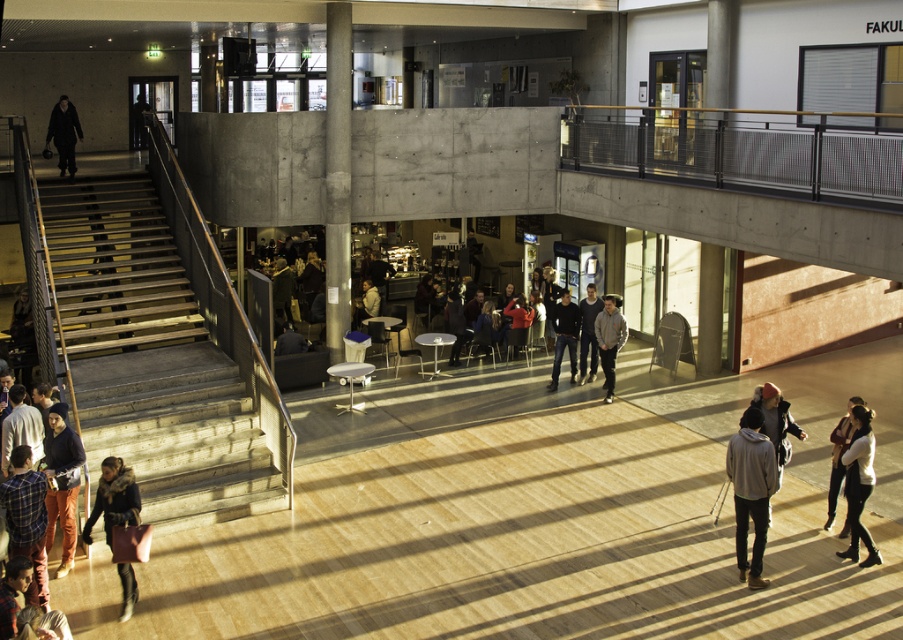
Question: Among these points, which one is farthest from the camera?

Choices:
 (A) (846, 449)
 (B) (58, 406)
 (C) (580, 381)
 (D) (551, 388)

Answer: (C)

Question: Which of the following is the closest to the observer?

Choices:
 (A) click(x=399, y=260)
 (B) click(x=61, y=118)
 (C) click(x=738, y=429)

Answer: (C)

Question: Observing the image, what is the correct spatial positioning of gray hoodie at lower right in reference to velvet brown coat at lower left?

Choices:
 (A) left
 (B) right

Answer: (B)

Question: Which of the following is the farthest from the observer?

Choices:
 (A) (574, 369)
 (B) (436, 323)
 (C) (17, 445)
 (D) (72, 534)

Answer: (B)

Question: Can you confirm if white sweater at lower right is wider than gray cotton hoodie at center?

Choices:
 (A) yes
 (B) no

Answer: (B)

Question: Does dark blue jeans at center appear on the left side of dark gray hoodie at center?

Choices:
 (A) no
 (B) yes

Answer: (B)